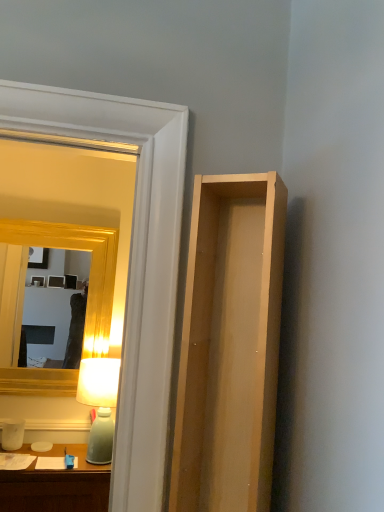
You are a GUI agent. You are given a task and a screenshot of the screen. Output one action in this format:
    pyautogui.click(x=<x>, y=<y>)
    Task: Click on the gold wooden mirror at upper left
    
    Given the screenshot: What is the action you would take?
    pyautogui.click(x=63, y=247)

Considering the positions of objects matte green glass table lamp at left and gold wooden mirror at upper left in the image provided, who is more to the right, matte green glass table lamp at left or gold wooden mirror at upper left?

Positioned to the right is matte green glass table lamp at left.

Is point (90, 432) farther from viewer compared to point (100, 292)?

No, it is in front of (100, 292).

Does matte green glass table lamp at left contain gold wooden mirror at upper left?

Definitely not — gold wooden mirror at upper left is not inside matte green glass table lamp at left.

Between matte green glass table lamp at left and gold wooden mirror at upper left, which one has more height?

gold wooden mirror at upper left.

Is light wood cabinet at right smaller than matte green glass table lamp at left?

Actually, light wood cabinet at right might be larger than matte green glass table lamp at left.

From a real-world perspective, relative to matte green glass table lamp at left, is light wood cabinet at right vertically above or below?

In terms of real-world spatial position, light wood cabinet at right is above matte green glass table lamp at left.

Is matte green glass table lamp at left inside light wood cabinet at right?

No, light wood cabinet at right does not contain matte green glass table lamp at left.

In order to click on glass door that is above the gold wooden mirror at upper left (from the image's perspective) in this screenshot , I will do `click(130, 258)`.

Does clear glass door at upper left have a larger size compared to gold wooden mirror at upper left?

No.

Between clear glass door at upper left and gold wooden mirror at upper left, which one has larger width?

clear glass door at upper left is wider.

Consider the image. From the image's perspective, between gold wooden mirror at upper left and matte green glass table lamp at left, which one is located above?

gold wooden mirror at upper left is shown above in the image.

Considering the relative positions of gold wooden mirror at upper left and matte green glass table lamp at left in the image provided, is gold wooden mirror at upper left in front of matte green glass table lamp at left?

No, it is not.

Is matte green glass table lamp at left completely or partially inside gold wooden mirror at upper left?

No, matte green glass table lamp at left is not surrounded by gold wooden mirror at upper left.

Does gold wooden mirror at upper left have a lesser width compared to matte green glass table lamp at left?

Yes.

Can you confirm if gold wooden mirror at upper left is shorter than light wood cabinet at right?

In fact, gold wooden mirror at upper left may be taller than light wood cabinet at right.

Considering the positions of point (22, 268) and point (263, 404), is point (22, 268) closer or farther from the camera than point (263, 404)?

Point (22, 268).

Choose the correct answer: Is gold wooden mirror at upper left inside light wood cabinet at right or outside it?

The correct answer is: outside.

Is gold wooden mirror at upper left turned away from light wood cabinet at right?

No.

Is clear glass door at upper left turned away from matte green glass table lamp at left?

Yes, clear glass door at upper left is positioned with its back facing matte green glass table lamp at left.

From the image's perspective, is clear glass door at upper left located beneath matte green glass table lamp at left?

No.

Considering the sizes of objects clear glass door at upper left and matte green glass table lamp at left in the image provided, who is taller, clear glass door at upper left or matte green glass table lamp at left?

Standing taller between the two is clear glass door at upper left.

Which object is closer to the camera taking this photo, clear glass door at upper left or matte green glass table lamp at left?

clear glass door at upper left is in front.

Is gold wooden mirror at upper left facing towards clear glass door at upper left?

Yes, gold wooden mirror at upper left is aimed at clear glass door at upper left.

Consider the image. Considering the sizes of gold wooden mirror at upper left and clear glass door at upper left in the image, is gold wooden mirror at upper left taller or shorter than clear glass door at upper left?

gold wooden mirror at upper left is shorter than clear glass door at upper left.

Looking at this image, would you say gold wooden mirror at upper left is a long distance from clear glass door at upper left?

Yes, gold wooden mirror at upper left and clear glass door at upper left are quite far apart.

Considering the relative sizes of gold wooden mirror at upper left and clear glass door at upper left in the image provided, is gold wooden mirror at upper left thinner than clear glass door at upper left?

Indeed, gold wooden mirror at upper left has a lesser width compared to clear glass door at upper left.

In order to click on mirror behind the matte green glass table lamp at left in this screenshot , I will do `click(63, 247)`.

You are a GUI agent. You are given a task and a screenshot of the screen. Output one action in this format:
    pyautogui.click(x=<x>, y=<y>)
    Task: Click on the cabinet in front of the matte green glass table lamp at left
    The image size is (384, 512).
    Given the screenshot: What is the action you would take?
    coord(230,345)

From the image, which object appears to be nearer to light wood cabinet at right, clear glass door at upper left or matte green glass table lamp at left?

clear glass door at upper left is positioned closer to the anchor light wood cabinet at right.

When comparing their distances from matte green glass table lamp at left, does gold wooden mirror at upper left or clear glass door at upper left seem further?

Based on the image, clear glass door at upper left appears to be further to matte green glass table lamp at left.

Estimate the real-world distances between objects in this image. Which object is further from matte green glass table lamp at left, clear glass door at upper left or gold wooden mirror at upper left?

Among the two, clear glass door at upper left is located further to matte green glass table lamp at left.

When comparing their distances from gold wooden mirror at upper left, does clear glass door at upper left or matte green glass table lamp at left seem further?

Based on the image, clear glass door at upper left appears to be further to gold wooden mirror at upper left.

Based on their spatial positions, is gold wooden mirror at upper left or light wood cabinet at right further from matte green glass table lamp at left?

Among the two, light wood cabinet at right is located further to matte green glass table lamp at left.

Looking at the image, which one is located closer to gold wooden mirror at upper left, matte green glass table lamp at left or light wood cabinet at right?

matte green glass table lamp at left.

Based on the photo, considering their positions, is matte green glass table lamp at left positioned further to gold wooden mirror at upper left than clear glass door at upper left?

clear glass door at upper left is positioned further to the anchor gold wooden mirror at upper left.

Considering their positions, is gold wooden mirror at upper left positioned closer to light wood cabinet at right than matte green glass table lamp at left?

matte green glass table lamp at left is closer to light wood cabinet at right.

This screenshot has width=384, height=512. In order to click on glass door positioned between light wood cabinet at right and gold wooden mirror at upper left from near to far in this screenshot , I will do `click(130, 258)`.

Find the location of a particular element. The height and width of the screenshot is (512, 384). glass door positioned between light wood cabinet at right and matte green glass table lamp at left from near to far is located at coordinates (130, 258).

You are a GUI agent. You are given a task and a screenshot of the screen. Output one action in this format:
    pyautogui.click(x=<x>, y=<y>)
    Task: Click on the table lamp between clear glass door at upper left and gold wooden mirror at upper left from front to back
    Image resolution: width=384 pixels, height=512 pixels.
    Given the screenshot: What is the action you would take?
    pyautogui.click(x=99, y=404)

Where is `table lamp between light wood cabinet at right and gold wooden mirror at upper left along the z-axis`? table lamp between light wood cabinet at right and gold wooden mirror at upper left along the z-axis is located at coordinates (99, 404).